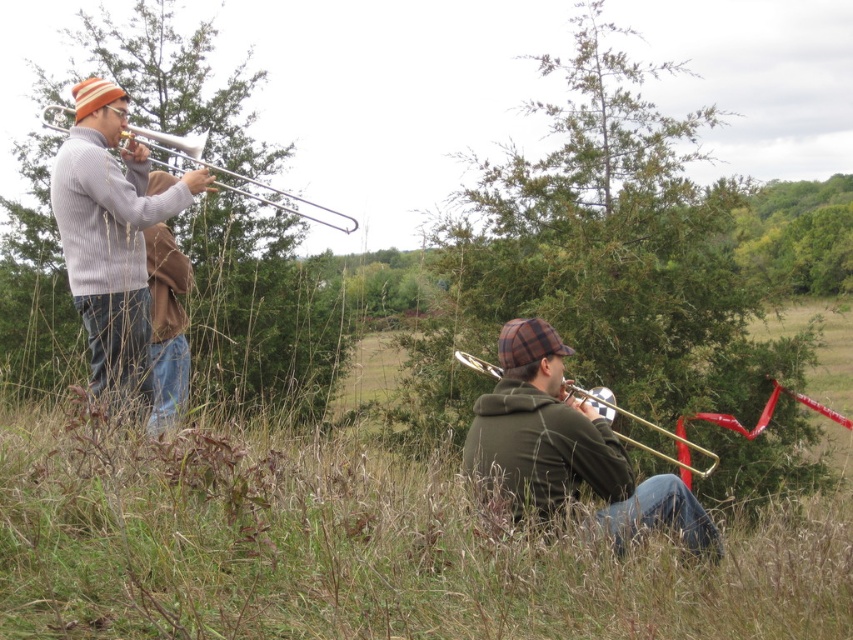
From the picture: You are a photographer trying to capture the knit wool sweater at left in your shot. Based on its position, where should you aim your camera? Please provide the coordinates as a point in the format of a tuple with two decimal numbers between 0 and 1.

The knit wool sweater at left is located at coordinates point (122,248), so you should aim your camera at that point to capture it.

You are a music teacher observing two students playing instruments in a park. You notice the matte silver trombone at left and the shiny brass trumpet at lower right. Which instrument is taller?

The matte silver trombone at left is taller than the shiny brass trumpet at lower right.

You are a photographer trying to capture a closeup of the knit wool sweater at left and the matte silver trombone at left. Your camera has a maximum focus range of 1.2 meters. Can you fit both objects within the camera frame without moving the camera?

The knit wool sweater at left and matte silver trombone at left are 1.24 meters apart from each other. Since the distance between them exceeds the camera maximum focus range of 1.2 meters, you cannot fit both objects within the camera frame without moving the camera.